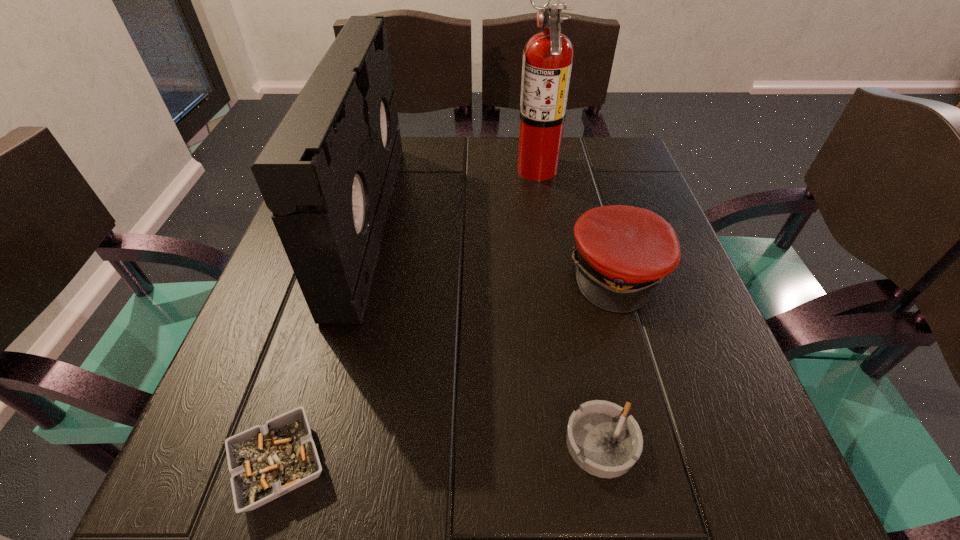
Identify the location of vacant region between the right ashtray and the left ashtray. (441, 454).

At what (x,y) coordinates should I click in order to perform the action: click on vacant region between the third tallest object and the videotape. Please return your answer as a coordinate pair (x, y). This screenshot has height=540, width=960. Looking at the image, I should click on click(x=493, y=246).

Where is `blank region between the fourth shortest object and the right ashtray`? This screenshot has width=960, height=540. blank region between the fourth shortest object and the right ashtray is located at coordinates (485, 332).

Identify which object is the nearest to the left ashtray. Please provide its 2D coordinates. Your answer should be formatted as a tuple, i.e. [(x, y)], where the tuple contains the x and y coordinates of a point satisfying the conditions above.

[(327, 173)]

Select which object appears as the third closest to the left ashtray. Please provide its 2D coordinates. Your answer should be formatted as a tuple, i.e. [(x, y)], where the tuple contains the x and y coordinates of a point satisfying the conditions above.

[(622, 252)]

At what (x,y) coordinates should I click in order to perform the action: click on vacant region that satisfies the following two spatial constraints: 1. on the nozzle side of the right ashtray; 2. on the right side of the fire extinguisher. Please return your answer as a coordinate pair (x, y). The height and width of the screenshot is (540, 960). Looking at the image, I should click on (582, 443).

Identify the location of vacant region that satisfies the following two spatial constraints: 1. on the nozzle side of the tallest object; 2. on the right side of the right ashtray. (582, 443).

Where is `vacant region that satisfies the following two spatial constraints: 1. on the nozzle side of the fire extinguisher; 2. on the front side of the left ashtray`? Image resolution: width=960 pixels, height=540 pixels. vacant region that satisfies the following two spatial constraints: 1. on the nozzle side of the fire extinguisher; 2. on the front side of the left ashtray is located at coordinates (585, 464).